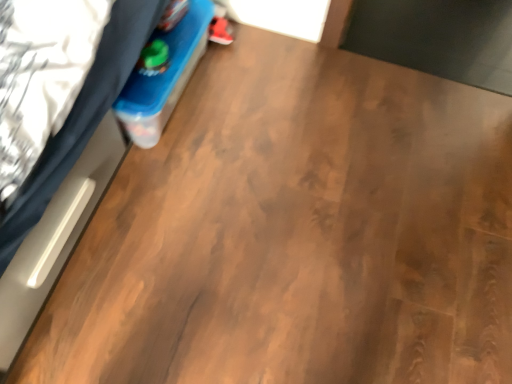
This screenshot has width=512, height=384. I want to click on unoccupied region to the right of matte red sneaker at upper center, so click(265, 50).